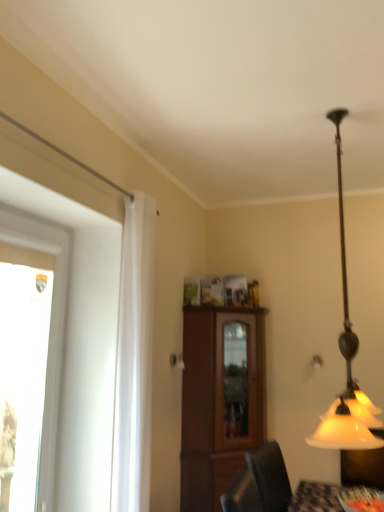
I want to click on free space above matte glass lampshade at right (from a real-world perspective), so click(x=337, y=103).